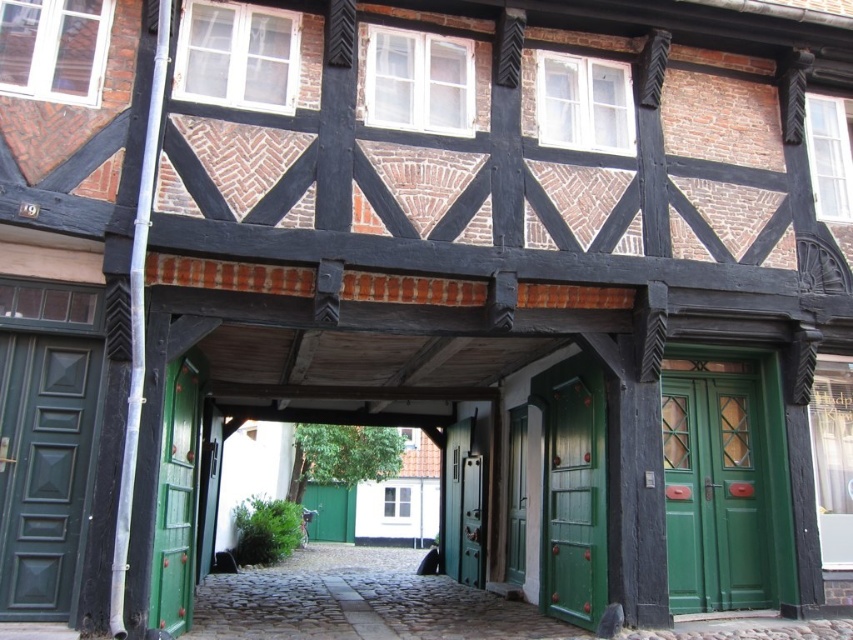
Which is in front, point (585, 465) or point (525, 477)?

Point (585, 465) is more forward.

Can you confirm if green wooden door at center is smaller than green matte door at center?

Actually, green wooden door at center might be larger than green matte door at center.

Does point (601, 492) come in front of point (508, 552)?

That is True.

Image resolution: width=853 pixels, height=640 pixels. I want to click on green wooden door at center, so click(x=573, y=502).

The image size is (853, 640). What do you see at coordinates (515, 496) in the screenshot? I see `green matte door at center` at bounding box center [515, 496].

Who is positioned more to the left, green matte door at center or metallic silver door at center?

Positioned to the left is metallic silver door at center.

Does point (509, 486) come behind point (479, 554)?

No, it is in front of (479, 554).

The height and width of the screenshot is (640, 853). I want to click on green matte door at center, so click(515, 496).

Is point (747, 388) positioned behind point (518, 436)?

No, it is in front of (518, 436).

Which of these two, green glossy door at center or green matte door at center, stands shorter?

green glossy door at center is shorter.

Where is `green glossy door at center`? The height and width of the screenshot is (640, 853). green glossy door at center is located at coordinates (714, 496).

Find the location of `green glossy door at center`. green glossy door at center is located at coordinates 714,496.